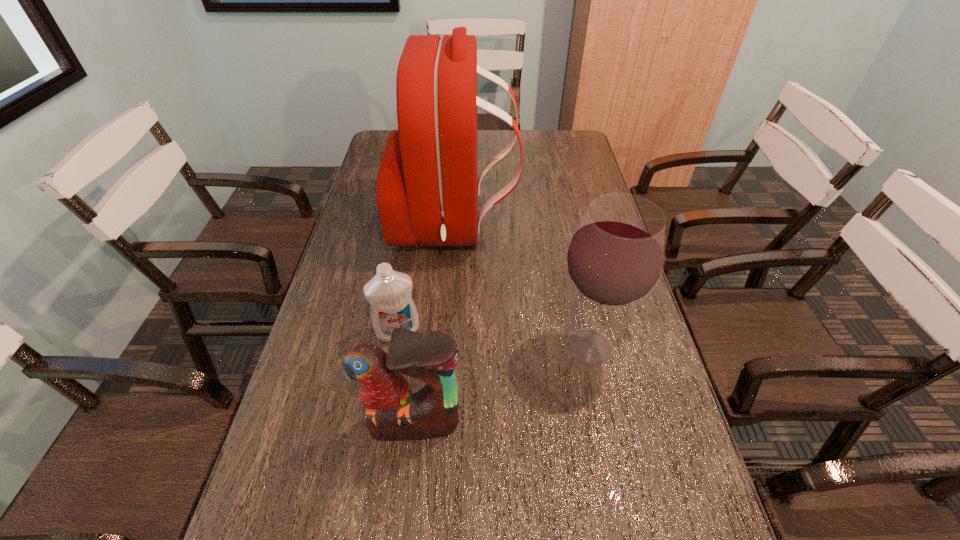
The height and width of the screenshot is (540, 960). Find the location of `the tallest object`. the tallest object is located at coordinates (427, 189).

Identify the location of backpack. (427, 189).

I want to click on the third shortest object, so click(x=615, y=258).

At what (x,y) coordinates should I click in order to perform the action: click on alcohol. Please return your answer as a coordinate pair (x, y). The image size is (960, 540). Looking at the image, I should click on (615, 258).

Locate an element on the screen. parrot is located at coordinates (391, 412).

Locate an element on the screen. the shortest object is located at coordinates (389, 292).

Where is `free point located 0.280m on the strap side of the tallest object`? free point located 0.280m on the strap side of the tallest object is located at coordinates (602, 225).

Identify the location of free point located on the back of the alcohol. The width and height of the screenshot is (960, 540). (576, 286).

Where is `vacant space situated at the face of the nearest object`? vacant space situated at the face of the nearest object is located at coordinates (406, 495).

You are a GUI agent. You are given a task and a screenshot of the screen. Output one action in this format:
    pyautogui.click(x=<x>, y=<y>)
    Task: Click on the free location located on the front of the shortest object
    The height and width of the screenshot is (540, 960).
    Given the screenshot: What is the action you would take?
    pyautogui.click(x=371, y=495)